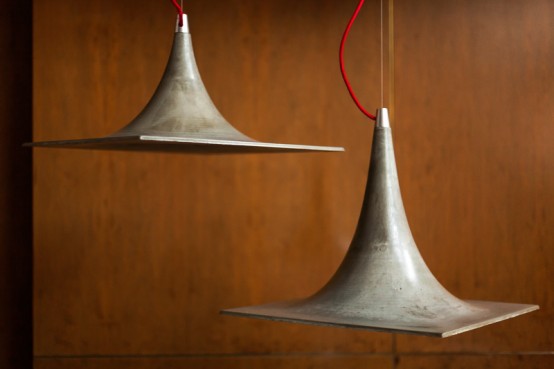
Where is `top right of the wall`? top right of the wall is located at coordinates click(x=506, y=115).